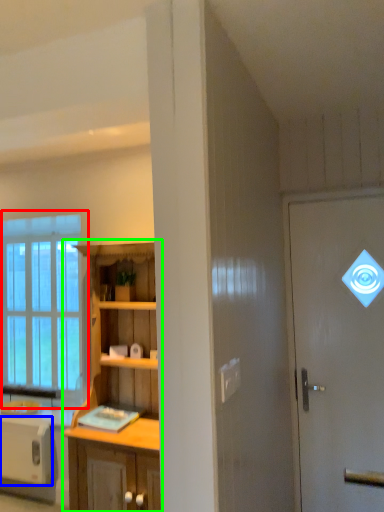
Question: Which is nearer to the window (highlighted by a red box)? appliance (highlighted by a blue box) or cabinetry (highlighted by a green box).

Choices:
 (A) appliance
 (B) cabinetry

Answer: (A)